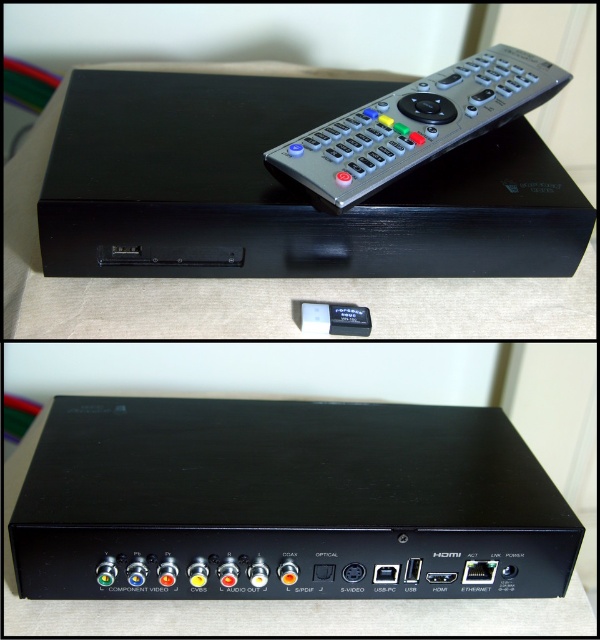
Between point (169, 305) and point (535, 92), which one is positioned in front?

Point (169, 305) is more forward.

Which is more to the right, black matte/black plastic table at upper center or silver metallic remote at upper center?

silver metallic remote at upper center

Find the location of a particular element. black matte/black plastic table at upper center is located at coordinates (259, 289).

Is black plastic device at center to the right of silver metallic remote at upper center from the viewer's perspective?

In fact, black plastic device at center is to the left of silver metallic remote at upper center.

Looking at this image, who is shorter, black plastic device at center or silver metallic remote at upper center?

Standing shorter between the two is black plastic device at center.

Is point (108, 400) closer to camera compared to point (306, 156)?

No, it is behind (306, 156).

Identify the location of black plastic device at center. The height and width of the screenshot is (640, 600). (286, 502).

Is black plastic device at center positioned behind black matte/black plastic table at upper center?

No, it is not.

Who is higher up, black plastic device at center or black matte/black plastic table at upper center?

black matte/black plastic table at upper center is higher up.

The height and width of the screenshot is (640, 600). Find the location of `black plastic device at center`. black plastic device at center is located at coordinates (286, 502).

You are a GUI agent. You are given a task and a screenshot of the screen. Output one action in this format:
    pyautogui.click(x=<x>, y=<y>)
    Task: Click on the black plastic device at center
    
    Given the screenshot: What is the action you would take?
    pyautogui.click(x=286, y=502)